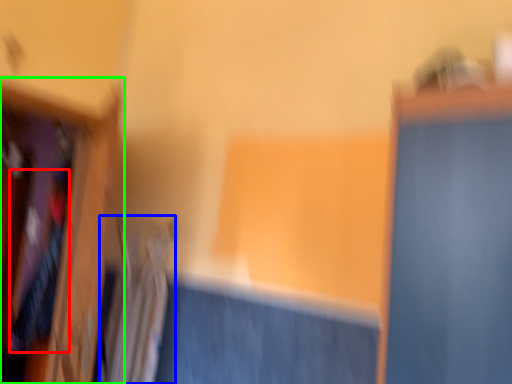
Question: Which object is the farthest from clothing (highlighted by a red box)? Choose among these: radiator (highlighted by a blue box) or furniture (highlighted by a green box).

Choices:
 (A) radiator
 (B) furniture

Answer: (A)